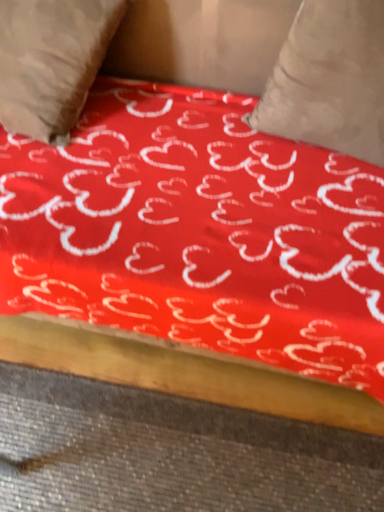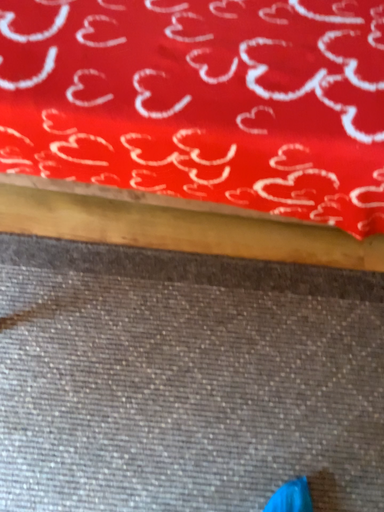
Question: Which way did the camera rotate in the video?

Choices:
 (A) rotated downward
 (B) rotated upward

Answer: (A)